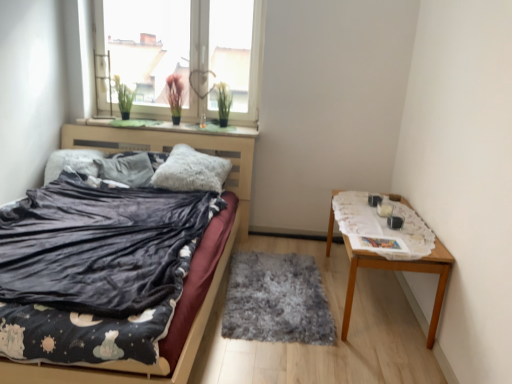
What are the coordinates of `free space underneath transparent glass window at upper center (from a real-world perspective)` in the screenshot? It's located at tap(158, 117).